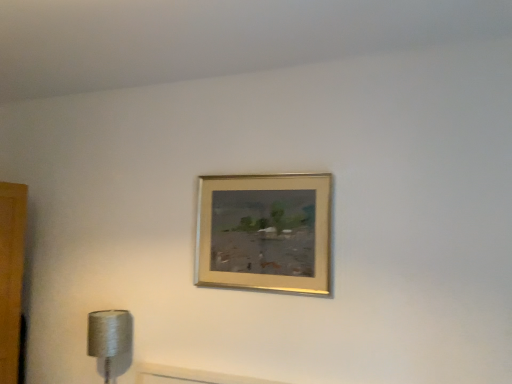
The height and width of the screenshot is (384, 512). Find the location of `silver metallic lamp at lower left`. silver metallic lamp at lower left is located at coordinates (109, 335).

Describe the element at coordinates (109, 335) in the screenshot. This screenshot has height=384, width=512. I see `silver metallic lamp at lower left` at that location.

Image resolution: width=512 pixels, height=384 pixels. What do you see at coordinates (265, 232) in the screenshot?
I see `gold metallic picture frame at upper center` at bounding box center [265, 232].

This screenshot has height=384, width=512. What are the coordinates of `gold metallic picture frame at upper center` in the screenshot? It's located at (265, 232).

I want to click on silver metallic lamp at lower left, so click(x=109, y=335).

Which object is positioned more to the right, silver metallic lamp at lower left or gold metallic picture frame at upper center?

gold metallic picture frame at upper center.

Which object is closer to the camera, silver metallic lamp at lower left or gold metallic picture frame at upper center?

gold metallic picture frame at upper center is more forward.

Is point (124, 345) less distant than point (319, 216)?

No, it is behind (319, 216).

From the image's perspective, which is above, silver metallic lamp at lower left or gold metallic picture frame at upper center?

gold metallic picture frame at upper center is shown above in the image.

From a real-world perspective, is silver metallic lamp at lower left above or below gold metallic picture frame at upper center?

silver metallic lamp at lower left is situated lower than gold metallic picture frame at upper center in the real world.

Between silver metallic lamp at lower left and gold metallic picture frame at upper center, which one has smaller width?

gold metallic picture frame at upper center.

Is silver metallic lamp at lower left shorter than gold metallic picture frame at upper center?

Indeed, silver metallic lamp at lower left has a lesser height compared to gold metallic picture frame at upper center.

In terms of size, does silver metallic lamp at lower left appear bigger or smaller than gold metallic picture frame at upper center?

silver metallic lamp at lower left is bigger than gold metallic picture frame at upper center.

Is silver metallic lamp at lower left not inside gold metallic picture frame at upper center?

Absolutely, silver metallic lamp at lower left is external to gold metallic picture frame at upper center.

Is silver metallic lamp at lower left not close to gold metallic picture frame at upper center?

That's not correct — silver metallic lamp at lower left is a little close to gold metallic picture frame at upper center.

Does silver metallic lamp at lower left turn towards gold metallic picture frame at upper center?

No, silver metallic lamp at lower left is not facing towards gold metallic picture frame at upper center.

How different are the orientations of silver metallic lamp at lower left and gold metallic picture frame at upper center in degrees?

0.00782 degrees separate the facing orientations of silver metallic lamp at lower left and gold metallic picture frame at upper center.

The height and width of the screenshot is (384, 512). In order to click on lamp behind the gold metallic picture frame at upper center in this screenshot , I will do `click(109, 335)`.

Considering the positions of objects gold metallic picture frame at upper center and silver metallic lamp at lower left in the image provided, who is more to the left, gold metallic picture frame at upper center or silver metallic lamp at lower left?

From the viewer's perspective, silver metallic lamp at lower left appears more on the left side.

Between gold metallic picture frame at upper center and silver metallic lamp at lower left, which one is positioned in front?

gold metallic picture frame at upper center.

Is point (294, 230) closer to camera compared to point (123, 337)?

Yes, it is in front of point (123, 337).

From the image's perspective, between gold metallic picture frame at upper center and silver metallic lamp at lower left, who is located below?

silver metallic lamp at lower left is shown below in the image.

Consider the image. From a real-world perspective, is gold metallic picture frame at upper center positioned over silver metallic lamp at lower left based on gravity?

Yes, from a real-world perspective, gold metallic picture frame at upper center is on top of silver metallic lamp at lower left.

Between gold metallic picture frame at upper center and silver metallic lamp at lower left, which one has smaller width?

gold metallic picture frame at upper center.

Which of these two, gold metallic picture frame at upper center or silver metallic lamp at lower left, stands taller?

gold metallic picture frame at upper center is taller.

Who is smaller, gold metallic picture frame at upper center or silver metallic lamp at lower left?

gold metallic picture frame at upper center is smaller.

Is gold metallic picture frame at upper center situated inside silver metallic lamp at lower left or outside?

gold metallic picture frame at upper center lies outside silver metallic lamp at lower left.

Is gold metallic picture frame at upper center far away from silver metallic lamp at lower left?

No, there isn't a large distance between gold metallic picture frame at upper center and silver metallic lamp at lower left.

Is gold metallic picture frame at upper center aimed at silver metallic lamp at lower left?

No.

How many degrees apart are the facing directions of gold metallic picture frame at upper center and silver metallic lamp at lower left?

They differ by 0.00782 degrees in their facing directions.

Find the location of a particular element. The height and width of the screenshot is (384, 512). picture frame above the silver metallic lamp at lower left (from a real-world perspective) is located at coordinates (265, 232).

You are a GUI agent. You are given a task and a screenshot of the screen. Output one action in this format:
    pyautogui.click(x=<x>, y=<y>)
    Task: Click on the picture frame located above the silver metallic lamp at lower left (from the image's perspective)
    The height and width of the screenshot is (384, 512).
    Given the screenshot: What is the action you would take?
    pyautogui.click(x=265, y=232)

This screenshot has height=384, width=512. I want to click on lamp on the left of gold metallic picture frame at upper center, so click(x=109, y=335).